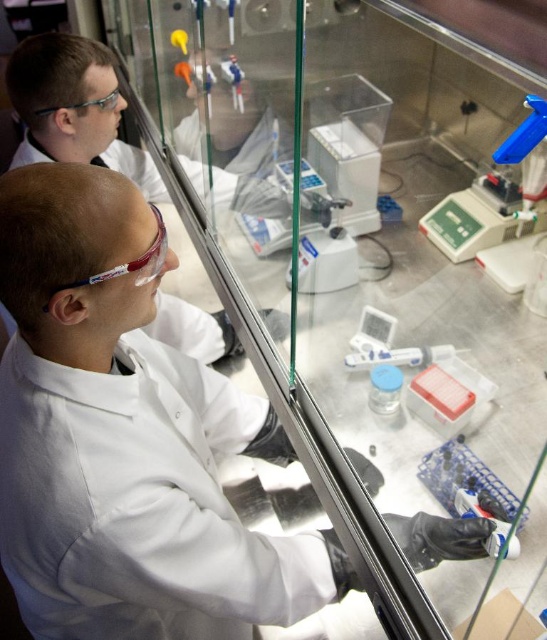
Does transparent plastic goggles at upper left appear on the right side of transparent plastic glasses at upper left?

Indeed, transparent plastic goggles at upper left is positioned on the right side of transparent plastic glasses at upper left.

Does point (150, 244) come closer to viewer compared to point (67, 108)?

Yes, point (150, 244) is closer to viewer.

This screenshot has width=547, height=640. In order to click on transparent plastic goggles at upper left in this screenshot , I will do `click(131, 262)`.

Can you confirm if white lab coat at upper left is thinner than transparent plastic goggles at upper left?

Incorrect, white lab coat at upper left's width is not less than transparent plastic goggles at upper left's.

Is point (156, 196) closer to viewer compared to point (148, 278)?

No, it is behind (148, 278).

The image size is (547, 640). Find the location of `white lab coat at upper left`. white lab coat at upper left is located at coordinates (73, 109).

Is white lab coat at upper left taller than transparent plastic glasses at upper left?

Correct, white lab coat at upper left is much taller as transparent plastic glasses at upper left.

Can you confirm if white lab coat at upper left is wider than transparent plastic glasses at upper left?

Indeed, white lab coat at upper left has a greater width compared to transparent plastic glasses at upper left.

Describe the element at coordinates (73, 109) in the screenshot. This screenshot has height=640, width=547. I see `white lab coat at upper left` at that location.

Where is `white lab coat at upper left`? The width and height of the screenshot is (547, 640). white lab coat at upper left is located at coordinates (73, 109).